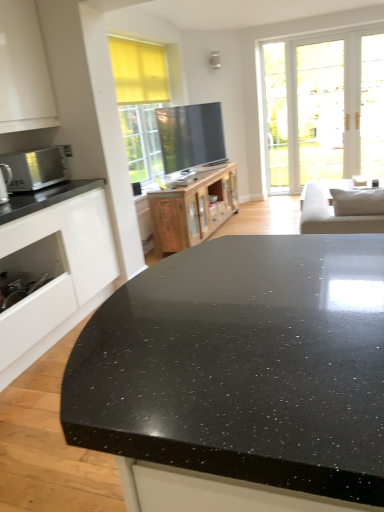
Question: From the image's perspective, is black speckled granite countertop at center below matte silver microwave at left?

Choices:
 (A) no
 (B) yes

Answer: (B)

Question: Does black speckled granite countertop at center appear on the right side of matte silver microwave at left?

Choices:
 (A) yes
 (B) no

Answer: (A)

Question: Is black speckled granite countertop at center smaller than matte silver microwave at left?

Choices:
 (A) yes
 (B) no

Answer: (B)

Question: From the image's perspective, is black speckled granite countertop at center on matte silver microwave at left?

Choices:
 (A) no
 (B) yes

Answer: (A)

Question: Is black speckled granite countertop at center oriented away from matte silver microwave at left?

Choices:
 (A) yes
 (B) no

Answer: (A)

Question: Does black speckled granite countertop at center have a greater height compared to matte silver microwave at left?

Choices:
 (A) no
 (B) yes

Answer: (B)

Question: Is wooden cabinet at center, the second cabinetry viewed from the front, thinner than matte silver microwave at left?

Choices:
 (A) yes
 (B) no

Answer: (B)

Question: Does wooden cabinet at center, placed as the 1th cabinetry when sorted from right to left, have a smaller size compared to matte silver microwave at left?

Choices:
 (A) yes
 (B) no

Answer: (B)

Question: Is wooden cabinet at center, the second cabinetry viewed from the front, in contact with matte silver microwave at left?

Choices:
 (A) no
 (B) yes

Answer: (A)

Question: Is wooden cabinet at center, placed as the 1th cabinetry when sorted from right to left, not near matte silver microwave at left?

Choices:
 (A) no
 (B) yes

Answer: (B)

Question: Can you confirm if wooden cabinet at center, which ranks as the 1th cabinetry in back-to-front order, is bigger than matte silver microwave at left?

Choices:
 (A) no
 (B) yes

Answer: (B)

Question: Is wooden cabinet at center, acting as the second cabinetry starting from the left, facing towards matte silver microwave at left?

Choices:
 (A) no
 (B) yes

Answer: (A)

Question: From the image's perspective, is satin silver microwave at left over white glossy cabinet at left, positioned as the 1th cabinetry in front-to-back order?

Choices:
 (A) yes
 (B) no

Answer: (A)